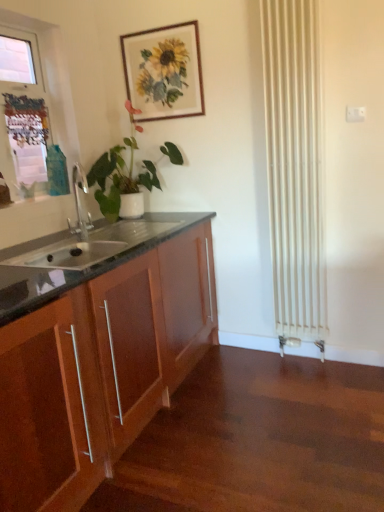
Question: From the image's perspective, is white plastic window frame at upper left on top of wooden cabinet at left?

Choices:
 (A) no
 (B) yes

Answer: (B)

Question: From a real-world perspective, is white plastic window frame at upper left located higher than wooden cabinet at left?

Choices:
 (A) no
 (B) yes

Answer: (B)

Question: Can you confirm if white plastic window frame at upper left is smaller than wooden cabinet at left?

Choices:
 (A) yes
 (B) no

Answer: (A)

Question: From the image's perspective, is white plastic window frame at upper left below wooden cabinet at left?

Choices:
 (A) yes
 (B) no

Answer: (B)

Question: Does white plastic window frame at upper left have a lesser height compared to wooden cabinet at left?

Choices:
 (A) no
 (B) yes

Answer: (B)

Question: Is white plastic window frame at upper left to the left of wooden cabinet at left from the viewer's perspective?

Choices:
 (A) no
 (B) yes

Answer: (B)

Question: From the image's perspective, is green matte plant at left over white plastic window frame at upper left?

Choices:
 (A) yes
 (B) no

Answer: (B)

Question: From a real-world perspective, is green matte plant at left over white plastic window frame at upper left?

Choices:
 (A) no
 (B) yes

Answer: (A)

Question: Does green matte plant at left turn towards white plastic window frame at upper left?

Choices:
 (A) yes
 (B) no

Answer: (B)

Question: Can you confirm if green matte plant at left is smaller than white plastic window frame at upper left?

Choices:
 (A) yes
 (B) no

Answer: (B)

Question: Does green matte plant at left have a greater height compared to white plastic window frame at upper left?

Choices:
 (A) yes
 (B) no

Answer: (B)

Question: Is green matte plant at left closer to camera compared to white plastic window frame at upper left?

Choices:
 (A) yes
 (B) no

Answer: (B)

Question: Is wooden cabinet at left located within green matte plant at left?

Choices:
 (A) yes
 (B) no

Answer: (B)